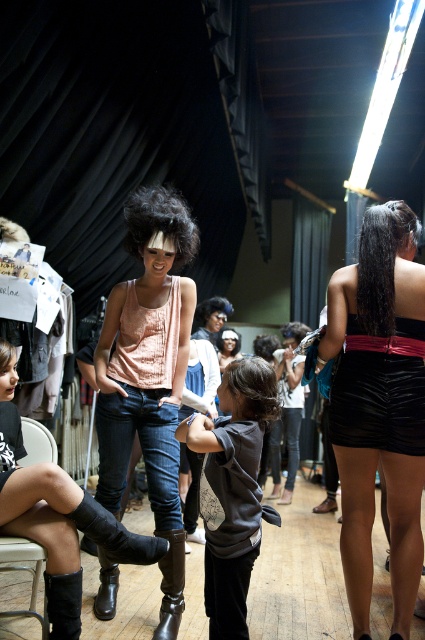
Question: Can you confirm if black leather boots at lower left is positioned to the left of black leather cowboy boot at lower left?

Choices:
 (A) yes
 (B) no

Answer: (A)

Question: Which of the following is the closest to the observer?

Choices:
 (A) (71, 573)
 (B) (155, 500)
 (C) (56, 632)

Answer: (C)

Question: Can you confirm if shiny black dress at center is positioned below black leather cowboy boot at lower center?

Choices:
 (A) no
 (B) yes

Answer: (A)

Question: Among these points, which one is nearest to the camera?

Choices:
 (A) (158, 541)
 (B) (414, 372)
 (C) (260, 490)

Answer: (A)

Question: Can you confirm if dark gray sweatshirt at center is positioned above black leather cowboy boot at lower left?

Choices:
 (A) no
 (B) yes

Answer: (B)

Question: Which object is positioned closest to the black leather cowboy boot at lower left?

Choices:
 (A) black leather boots at lower left
 (B) brown leather cowboy boot at lower center
 (C) dark gray sweatshirt at center
 (D) black leather cowboy boot at lower center

Answer: (A)